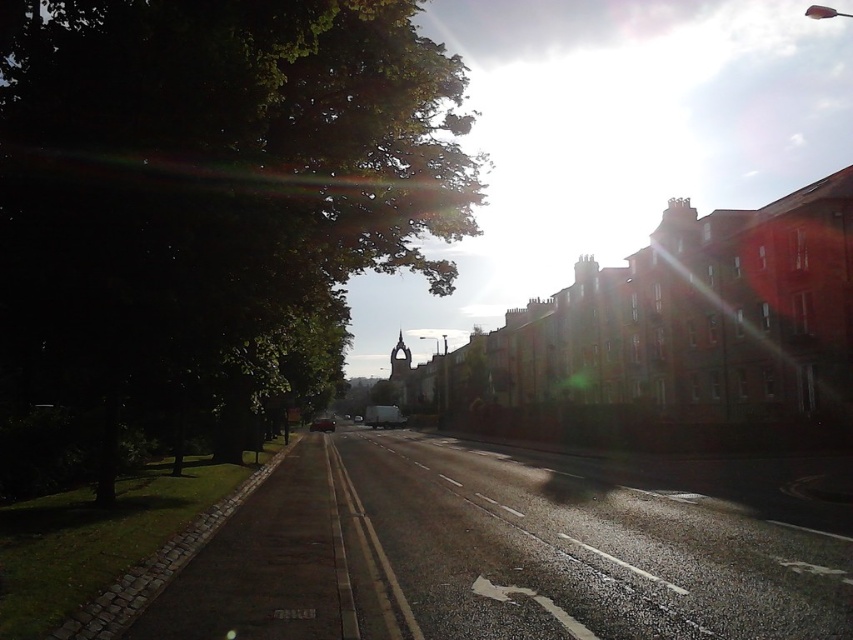
You are a delivery driver who needs to park your vehicle between the metallic silver van at center and the shiny silver car at center. The length of your delivery truck is 25 feet. Can your truck fit in the space between them?

The distance between the metallic silver van at center and the shiny silver car at center is 38.85 feet. Since your delivery truck is 25 feet long, there is enough space to park between them as 38.85 feet is greater than 25 feet.

You are standing at the point represented by point [206,214]. What is the nearest object to you?

The nearest object to you is the green leafy tree at left, as it is represented by point [206,214].